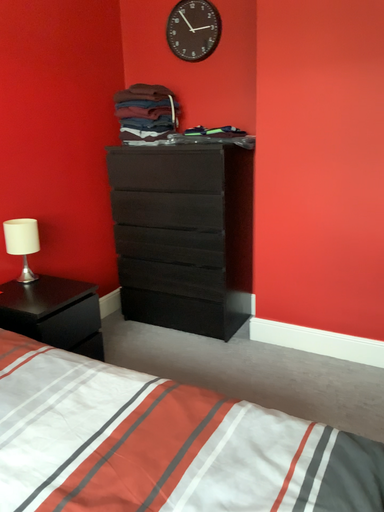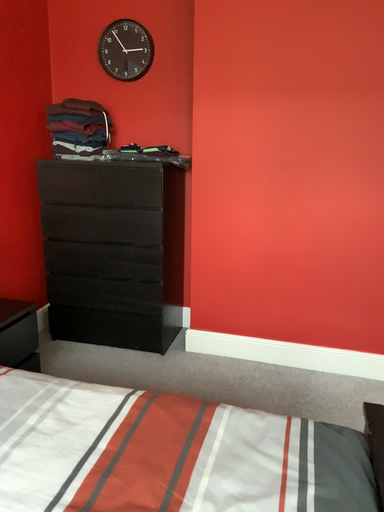
Question: How did the camera likely rotate when shooting the video?

Choices:
 (A) rotated right
 (B) rotated left

Answer: (A)